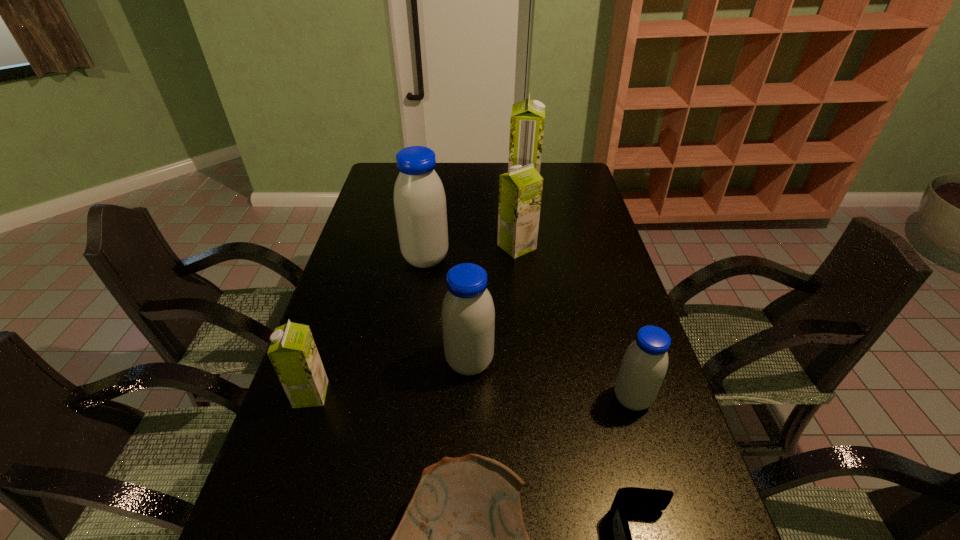
Locate an element on the screen. Image resolution: width=960 pixels, height=540 pixels. vacant point located between the second nearest blue soya milk and the biggest green soya milk is located at coordinates (496, 277).

Identify which object is located as the third nearest to the rightmost blue soya milk. Please provide its 2D coordinates. Your answer should be formatted as a tuple, i.e. [(x, y)], where the tuple contains the x and y coordinates of a point satisfying the conditions above.

[(468, 315)]

The image size is (960, 540). I want to click on object that is the fourth closest one to the farthest blue soya milk, so click(x=293, y=353).

Point out which soya milk is positioned as the nearest to the rightmost blue soya milk. Please provide its 2D coordinates. Your answer should be formatted as a tuple, i.e. [(x, y)], where the tuple contains the x and y coordinates of a point satisfying the conditions above.

[(468, 315)]

This screenshot has height=540, width=960. I want to click on soya milk that is the third closest one to the pottery, so click(x=644, y=365).

At what (x,y) coordinates should I click in order to perform the action: click on green soya milk identified as the third closest to the second farthest blue soya milk. Please return your answer as a coordinate pair (x, y). This screenshot has width=960, height=540. Looking at the image, I should click on pyautogui.click(x=527, y=120).

Identify which green soya milk is located as the second nearest to the pottery. Please provide its 2D coordinates. Your answer should be formatted as a tuple, i.e. [(x, y)], where the tuple contains the x and y coordinates of a point satisfying the conditions above.

[(520, 190)]

Identify which blue soya milk is the closest to the second smallest green soya milk. Please provide its 2D coordinates. Your answer should be formatted as a tuple, i.e. [(x, y)], where the tuple contains the x and y coordinates of a point satisfying the conditions above.

[(419, 198)]

Find the location of a particular element. The image size is (960, 540). blue soya milk that is the closest to the second blue soya milk from right to left is located at coordinates (644, 365).

You are a GUI agent. You are given a task and a screenshot of the screen. Output one action in this format:
    pyautogui.click(x=<x>, y=<y>)
    Task: Click on the vacant space that satisfies the following two spatial constraints: 1. on the front side of the second nearest blue soya milk; 2. on the left side of the farthest blue soya milk
    The width and height of the screenshot is (960, 540).
    Given the screenshot: What is the action you would take?
    pyautogui.click(x=410, y=362)